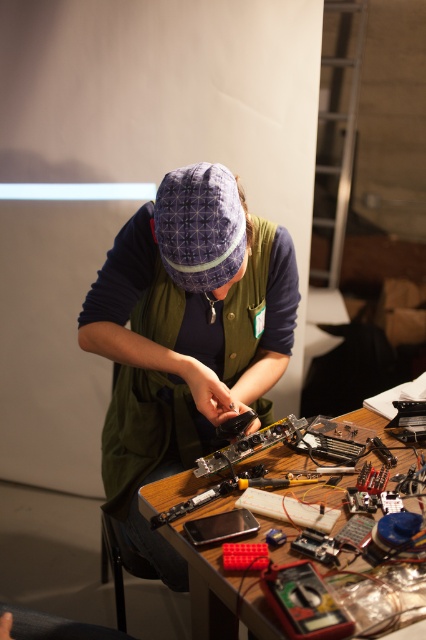
You are a technician working on the table and need to locate the purple fabric cap at upper center. According to the coordinates provided, where exactly is it positioned?

The purple fabric cap at upper center is located at point 0.525 on the x axis and 0.437 on the y axis.

You are a visitor in the workshop and want to locate the purple fabric cap at upper center and the wooden table at center. According to the scene, which object is positioned to the left of the other?

The purple fabric cap at upper center is to the left of the wooden table at center.

Consider the image. You are a visitor in the workshop and want to pick up the purple fabric cap at upper center. To reach it, you must pass the wooden table at center. Which object should you move closer to first?

The purple fabric cap at upper center is closer to you than the wooden table at center, so you should move closer to the purple fabric cap at upper center first before reaching the wooden table at center.